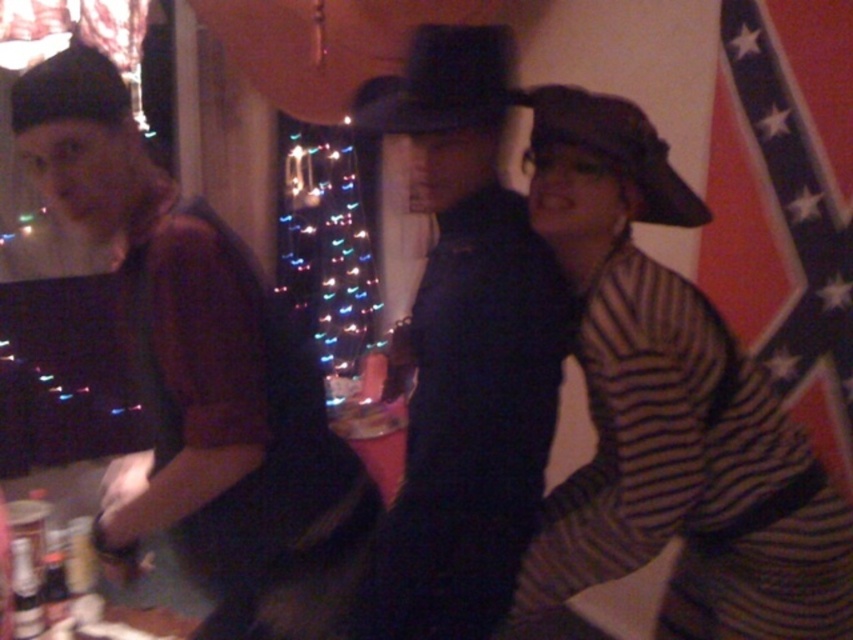
Question: Is matte black shirt at left to the right of black felt cowboy hat at center from the viewer's perspective?

Choices:
 (A) no
 (B) yes

Answer: (A)

Question: Which of the following is the closest to the observer?

Choices:
 (A) black felt cowboy hat at center
 (B) black felt cowboy hat at upper right

Answer: (A)

Question: Does red and white striped flag at right appear on the left side of black felt cowboy hat at center?

Choices:
 (A) yes
 (B) no

Answer: (B)

Question: Which of the following is the closest to the observer?

Choices:
 (A) (207, 394)
 (B) (488, 109)

Answer: (A)

Question: Does black felt cowboy hat at center have a larger size compared to black felt cowboy hat at upper right?

Choices:
 (A) no
 (B) yes

Answer: (B)

Question: Which of these objects is positioned farthest from the black felt cowboy hat at upper right?

Choices:
 (A) dark woolen hat at center
 (B) metallic can at center

Answer: (B)